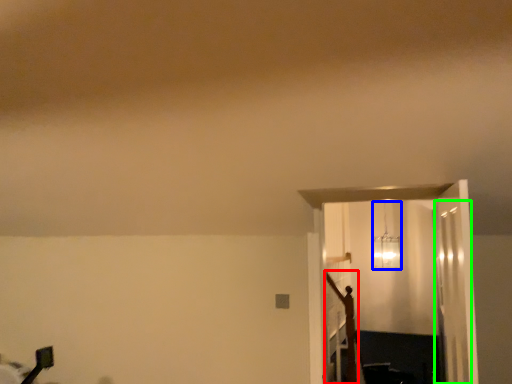
Question: Which object is the closest to the crucifix (highlighted by a red box)? Choose among these: lamp (highlighted by a blue box) or glass door (highlighted by a green box).

Choices:
 (A) lamp
 (B) glass door

Answer: (B)